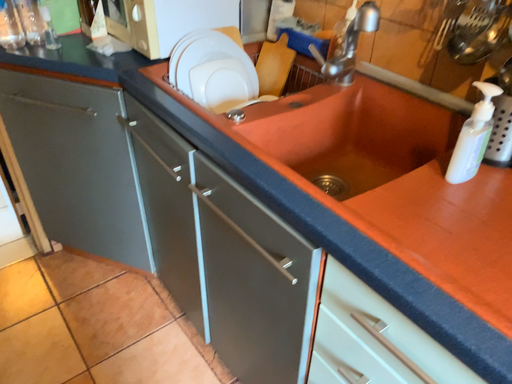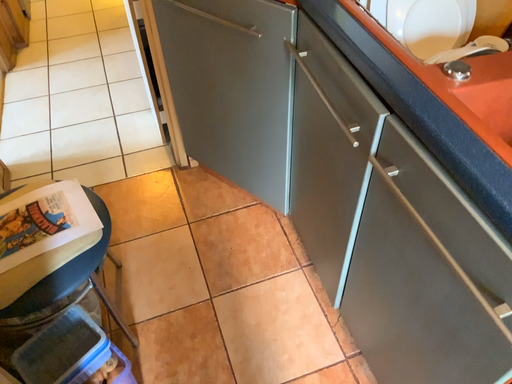
Question: How did the camera likely rotate when shooting the video?

Choices:
 (A) rotated right
 (B) rotated left

Answer: (B)